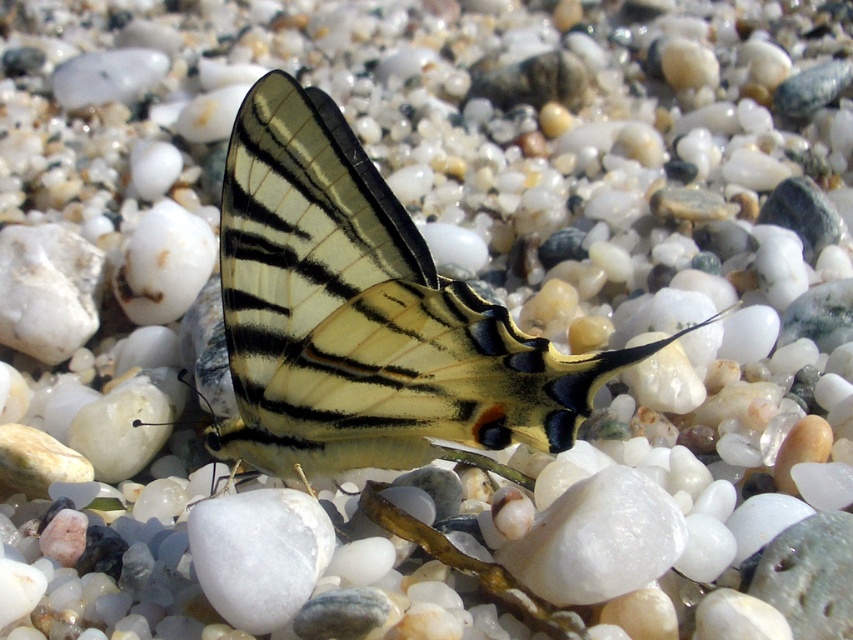
Identify the location of yellowish-green iridescent wings at center. (364, 317).

Measure the distance between yellowish-green iridescent wings at center and white smooth rock at center.

The distance of yellowish-green iridescent wings at center from white smooth rock at center is 5.28 inches.

Image resolution: width=853 pixels, height=640 pixels. In order to click on yellowish-green iridescent wings at center in this screenshot , I will do `click(364, 317)`.

Where is `yellowish-green iridescent wings at center`? Image resolution: width=853 pixels, height=640 pixels. yellowish-green iridescent wings at center is located at coordinates 364,317.